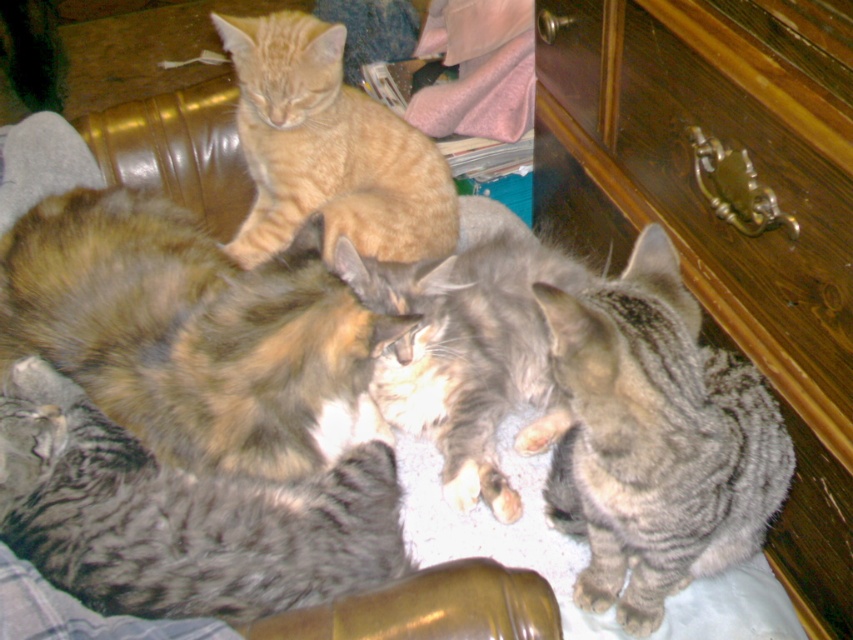
Question: Which of the following is the farthest from the observer?

Choices:
 (A) (144, 518)
 (B) (612, 529)
 (C) (469, 273)

Answer: (C)

Question: Which object is positioned closest to the orange tabby cat at upper left?

Choices:
 (A) calico fur cat at center
 (B) gray striped cat at lower left
 (C) gray striped cat at lower right

Answer: (A)

Question: Does calico fur cat at center have a smaller size compared to orange tabby cat at upper left?

Choices:
 (A) no
 (B) yes

Answer: (B)

Question: Does calico fur cat at center have a greater width compared to orange tabby cat at upper left?

Choices:
 (A) no
 (B) yes

Answer: (B)

Question: Is calico fur cat at center above gray striped cat at center?

Choices:
 (A) yes
 (B) no

Answer: (B)

Question: Which object is positioned closest to the gray striped cat at center?

Choices:
 (A) gray striped cat at lower left
 (B) gray striped cat at lower right
 (C) orange tabby cat at upper left
 (D) calico fur cat at center

Answer: (B)